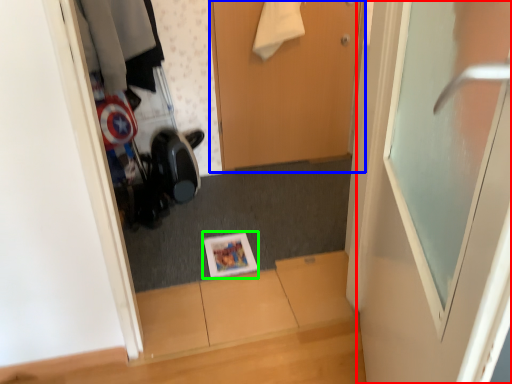
Question: Which object is the farthest from door (highlighted by a red box)? Choose among these: door (highlighted by a blue box) or magazine (highlighted by a green box).

Choices:
 (A) door
 (B) magazine

Answer: (A)